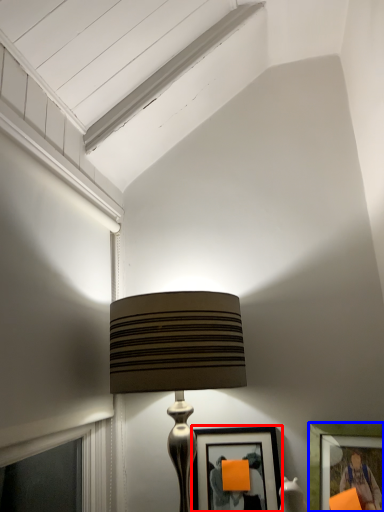
Question: Which object is closer to the camera taking this photo, picture frame (highlighted by a red box) or picture frame (highlighted by a blue box)?

Choices:
 (A) picture frame
 (B) picture frame

Answer: (B)